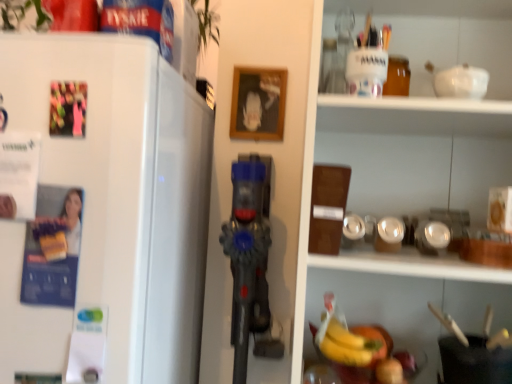
What is the approximate width of white matte refrigerator at left?

29.94 inches.

The width and height of the screenshot is (512, 384). In order to click on white matte refrigerator at left in this screenshot , I will do `click(127, 189)`.

Measure the distance between white matte refrigerator at left and camera.

white matte refrigerator at left and camera are 29.04 inches apart from each other.

The image size is (512, 384). What do you see at coordinates (127, 189) in the screenshot?
I see `white matte refrigerator at left` at bounding box center [127, 189].

Measure the distance between point (190,285) and camera.

A distance of 3.66 feet exists between point (190,285) and camera.

What is the approximate width of yellow matte bananas at lower center?

It is 8.78 inches.

Identify the location of yellow matte bananas at lower center. (409, 306).

Measure the distance between point (407, 287) and camera.

Point (407, 287) is 1.16 meters away from camera.

What do you see at coordinates (409, 306) in the screenshot?
I see `yellow matte bananas at lower center` at bounding box center [409, 306].

Find the location of a particular element. The image size is (512, 384). white matte refrigerator at left is located at coordinates (127, 189).

Which object is positioned more to the left, white matte refrigerator at left or yellow matte bananas at lower center?

white matte refrigerator at left is more to the left.

In the image, is white matte refrigerator at left positioned in front of or behind yellow matte bananas at lower center?

white matte refrigerator at left is in front of yellow matte bananas at lower center.

Which is behind, point (155, 108) or point (411, 324)?

The point (411, 324) is behind.

From the image's perspective, is white matte refrigerator at left located above or below yellow matte bananas at lower center?

From the image's perspective, white matte refrigerator at left appears above yellow matte bananas at lower center.

From a real-world perspective, is white matte refrigerator at left over yellow matte bananas at lower center?

Yes, from a real-world perspective, white matte refrigerator at left is above yellow matte bananas at lower center.

Does white matte refrigerator at left have a greater width compared to yellow matte bananas at lower center?

Yes.

Considering the relative sizes of white matte refrigerator at left and yellow matte bananas at lower center in the image provided, is white matte refrigerator at left taller than yellow matte bananas at lower center?

Indeed, white matte refrigerator at left has a greater height compared to yellow matte bananas at lower center.

Based on the photo, considering the relative sizes of white matte refrigerator at left and yellow matte bananas at lower center in the image provided, is white matte refrigerator at left bigger than yellow matte bananas at lower center?

Yes, white matte refrigerator at left is bigger than yellow matte bananas at lower center.

Can yellow matte bananas at lower center be found inside white matte refrigerator at left?

No.

Is white matte refrigerator at left not close to yellow matte bananas at lower center?

No, white matte refrigerator at left is not far from yellow matte bananas at lower center.

Is white matte refrigerator at left turned away from yellow matte bananas at lower center?

No, yellow matte bananas at lower center is not at the back of white matte refrigerator at left.

Can you tell me how much white matte refrigerator at left and yellow matte bananas at lower center differ in facing direction?

white matte refrigerator at left and yellow matte bananas at lower center are facing 0.44 degrees away from each other.

Measure the distance from white matte refrigerator at left to yellow matte bananas at lower center.

The distance of white matte refrigerator at left from yellow matte bananas at lower center is 61.40 centimeters.

The height and width of the screenshot is (384, 512). Find the location of `shelf on the right of white matte refrigerator at left`. shelf on the right of white matte refrigerator at left is located at coordinates (409, 306).

Is yellow matte bananas at lower center to the left of white matte refrigerator at left from the viewer's perspective?

No, yellow matte bananas at lower center is not to the left of white matte refrigerator at left.

In the scene shown: Considering the positions of objects yellow matte bananas at lower center and white matte refrigerator at left in the image provided, who is in front, yellow matte bananas at lower center or white matte refrigerator at left?

white matte refrigerator at left is in front.

Considering the points (474, 292) and (206, 152), which point is in front, point (474, 292) or point (206, 152)?

The point (474, 292) is in front.

From the image's perspective, is yellow matte bananas at lower center positioned above or below white matte refrigerator at left?

yellow matte bananas at lower center is situated lower than white matte refrigerator at left in the image.

From a real-world perspective, is yellow matte bananas at lower center positioned above or below white matte refrigerator at left?

In terms of real-world spatial position, yellow matte bananas at lower center is below white matte refrigerator at left.

In terms of width, does yellow matte bananas at lower center look wider or thinner when compared to white matte refrigerator at left?

yellow matte bananas at lower center is thinner than white matte refrigerator at left.

Consider the image. From their relative heights in the image, would you say yellow matte bananas at lower center is taller or shorter than white matte refrigerator at left?

In the image, yellow matte bananas at lower center appears to be shorter than white matte refrigerator at left.

Considering the sizes of objects yellow matte bananas at lower center and white matte refrigerator at left in the image provided, who is smaller, yellow matte bananas at lower center or white matte refrigerator at left?

yellow matte bananas at lower center.

Is yellow matte bananas at lower center inside or outside of white matte refrigerator at left?

yellow matte bananas at lower center is not inside white matte refrigerator at left, it's outside.

Would you say yellow matte bananas at lower center is a long distance from white matte refrigerator at left?

yellow matte bananas at lower center is actually quite close to white matte refrigerator at left.

Is yellow matte bananas at lower center facing towards white matte refrigerator at left?

No, yellow matte bananas at lower center is not turned towards white matte refrigerator at left.

How many degrees apart are the facing directions of yellow matte bananas at lower center and white matte refrigerator at left?

0.44 degrees.

How far apart are yellow matte bananas at lower center and white matte refrigerator at left?

yellow matte bananas at lower center is 24.17 inches away from white matte refrigerator at left.

Locate an element on the screen. refrigerator that appears above the yellow matte bananas at lower center (from the image's perspective) is located at coordinates (127, 189).

Where is `shelf behind the white matte refrigerator at left`? The image size is (512, 384). shelf behind the white matte refrigerator at left is located at coordinates (409, 306).

Image resolution: width=512 pixels, height=384 pixels. Find the location of `shelf lying on the right of white matte refrigerator at left`. shelf lying on the right of white matte refrigerator at left is located at coordinates (409, 306).